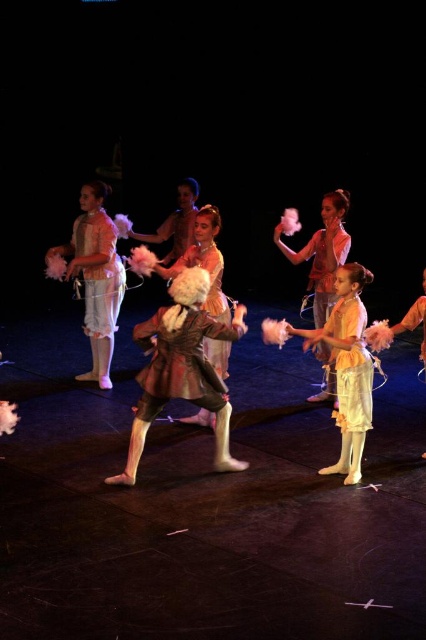
You are a photographer in the audience taking pictures of the stage. You notice two dresses at center stage, the matte yellow dress at center and the shiny silver dress at center. Which dress is closer to the front of the stage?

The matte yellow dress at center is closer to the front of the stage because it is in front of the shiny silver dress at center.

You are a stagehand preparing to move a large prop that requires a clear path to the center stage. You notice the matte yellow dress at center and the shiny silver dress at center. Which dress might block the path more due to its width?

The matte yellow dress at center might be wider than the shiny silver dress at center, so it could potentially block the path more due to its width.